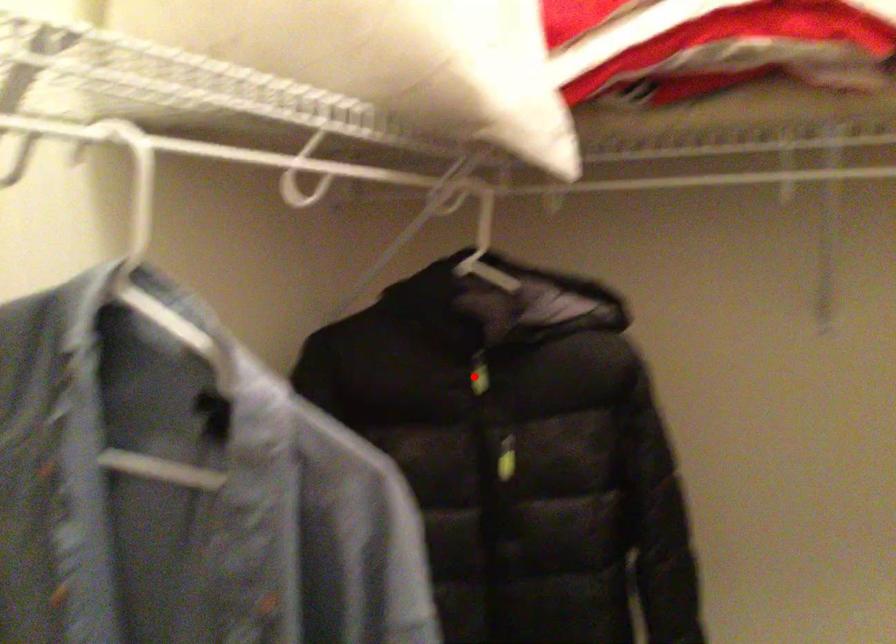
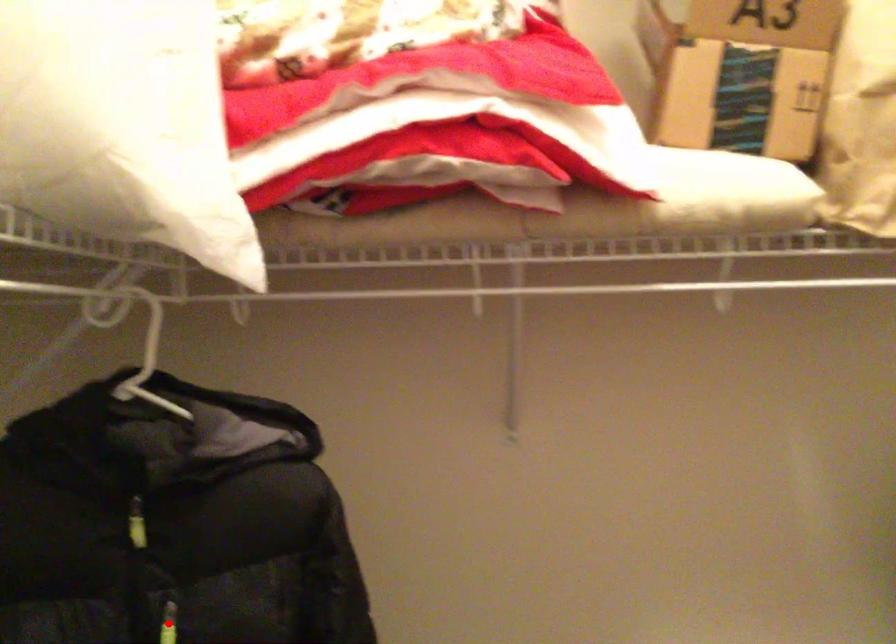
From the picture: I am providing you with two images of the same scene from different viewpoints. A red point is marked on the first image and another point is marked on the second image. Is the marked point in image1 the same physical position as the marked point in image2?

No